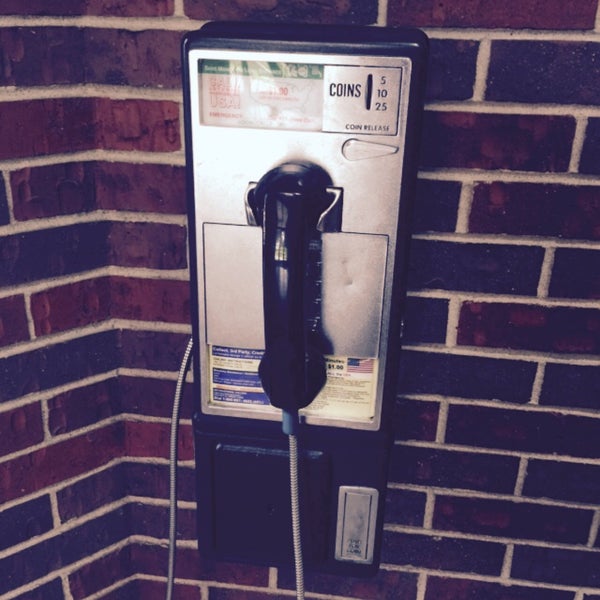
This screenshot has width=600, height=600. I want to click on cord, so click(x=297, y=470).